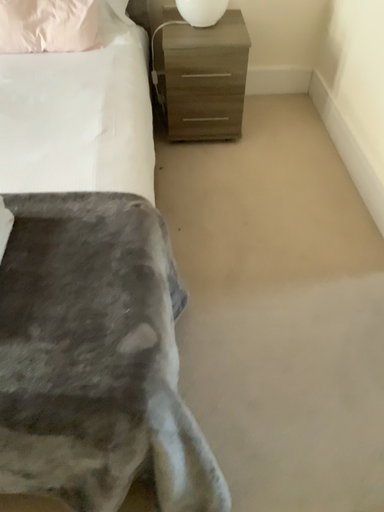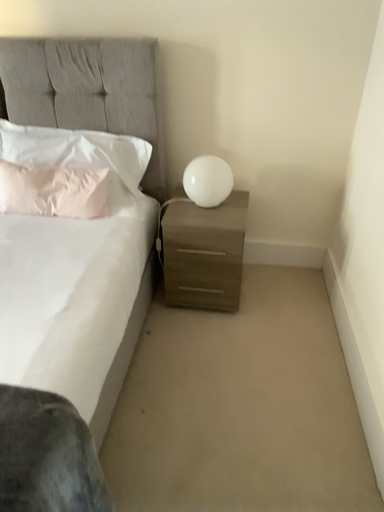
Question: How did the camera likely rotate when shooting the video?

Choices:
 (A) rotated right
 (B) rotated left

Answer: (B)